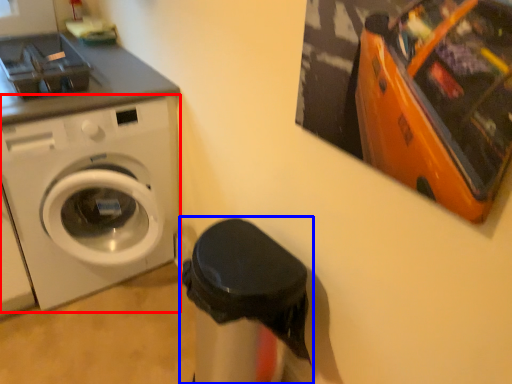
Question: Which object appears farthest to the camera in this image, washing machine (highlighted by a red box) or garbage (highlighted by a blue box)?

Choices:
 (A) washing machine
 (B) garbage

Answer: (A)